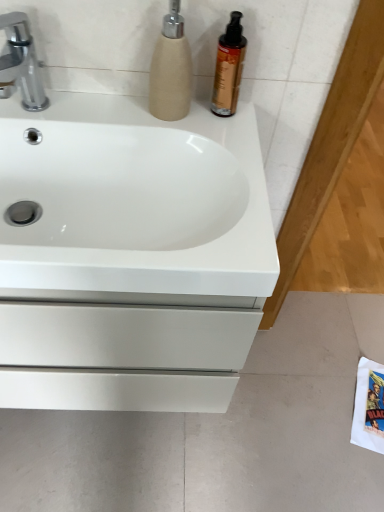
The image size is (384, 512). In order to click on free spot to the left of beige textured soap dispenser at upper center in this screenshot , I will do [107, 106].